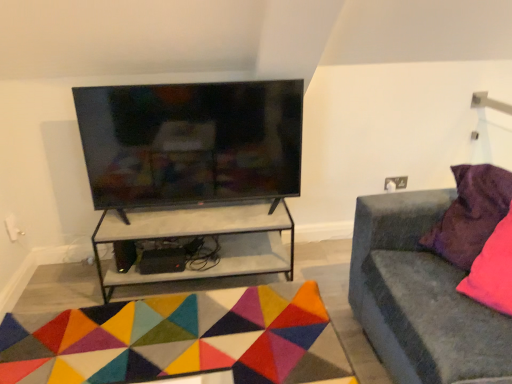
Question: Is multicolored felt mat at center completely or partially inside velvet grey couch at right?

Choices:
 (A) no
 (B) yes

Answer: (A)

Question: Is velvet grey couch at right smaller than multicolored felt mat at center?

Choices:
 (A) no
 (B) yes

Answer: (A)

Question: Is velvet grey couch at right oriented towards multicolored felt mat at center?

Choices:
 (A) yes
 (B) no

Answer: (A)

Question: Considering the relative sizes of velvet grey couch at right and multicolored felt mat at center in the image provided, is velvet grey couch at right bigger than multicolored felt mat at center?

Choices:
 (A) yes
 (B) no

Answer: (A)

Question: Would you say velvet grey couch at right is outside multicolored felt mat at center?

Choices:
 (A) yes
 (B) no

Answer: (A)

Question: Is point (498, 180) closer or farther from the camera than point (464, 263)?

Choices:
 (A) closer
 (B) farther

Answer: (A)

Question: From a real-world perspective, is purple velvet pillow at right above or below velvet grey couch at right?

Choices:
 (A) above
 (B) below

Answer: (A)

Question: Which is correct: purple velvet pillow at right is inside velvet grey couch at right, or outside of it?

Choices:
 (A) inside
 (B) outside

Answer: (A)

Question: In the image, is purple velvet pillow at right positioned in front of or behind velvet grey couch at right?

Choices:
 (A) behind
 (B) front

Answer: (A)

Question: Considering the positions of white concrete shelf at center and black glossy tv at upper center in the image, is white concrete shelf at center bigger or smaller than black glossy tv at upper center?

Choices:
 (A) big
 (B) small

Answer: (A)

Question: Visually, is white concrete shelf at center positioned to the left or to the right of black glossy tv at upper center?

Choices:
 (A) left
 (B) right

Answer: (A)

Question: In terms of height, does white concrete shelf at center look taller or shorter compared to black glossy tv at upper center?

Choices:
 (A) tall
 (B) short

Answer: (B)

Question: From the image's perspective, is white concrete shelf at center above or below black glossy tv at upper center?

Choices:
 (A) below
 (B) above

Answer: (A)

Question: From their relative heights in the image, would you say velvet grey couch at right is taller or shorter than black glossy tv at upper center?

Choices:
 (A) short
 (B) tall

Answer: (B)

Question: From a real-world perspective, relative to black glossy tv at upper center, is velvet grey couch at right vertically above or below?

Choices:
 (A) below
 (B) above

Answer: (A)